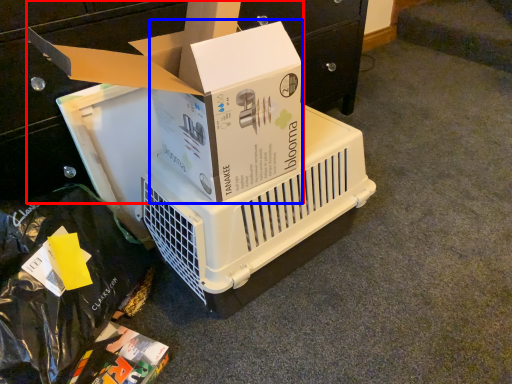
Question: Which object appears farthest to the camera in this image, box (highlighted by a red box) or box (highlighted by a blue box)?

Choices:
 (A) box
 (B) box

Answer: (B)